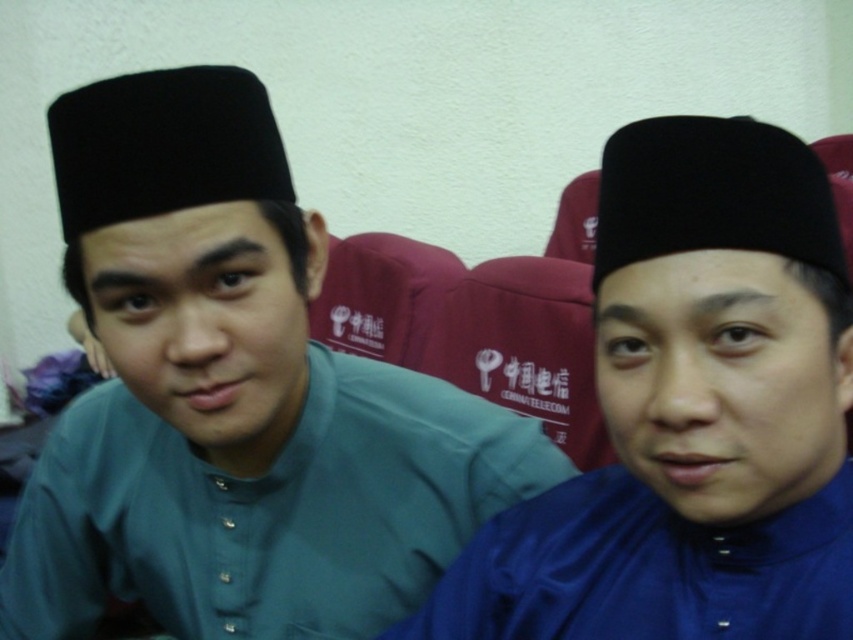
You are a photographer trying to capture a closeup of the blue satin hat at center and the black felt hat at upper center. Which hat should you focus on first if you want to start with the one that is more to the left?

The blue satin hat at center is positioned on the left side of black felt hat at upper center, so you should focus on the blue satin hat at center first since it is more to the left.

You are a photographer setting up for a group photo. You notice two hats in the scene. Which hat is positioned to the left of the other? The hats in question are the black matte hat at upper left and the black felt hat at upper center.

The black matte hat at upper left is positioned to the left of the black felt hat at upper center.

You are a photographer adjusting your camera settings to focus on two points in the image. The first point is at coordinates point (672, 518) and the second is at point (775, 236). Which point should you focus on first if you want to ensure both are in sharp focus?

You should focus on point (672, 518) first because it is closer to the camera than point (775, 236), allowing both points to be in focus when adjusting the depth of field.